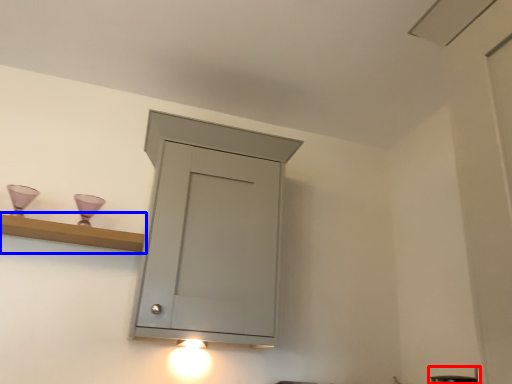
Question: Among these objects, which one is nearest to the camera, faucet (highlighted by a red box) or shelf (highlighted by a blue box)?

Choices:
 (A) faucet
 (B) shelf

Answer: (A)